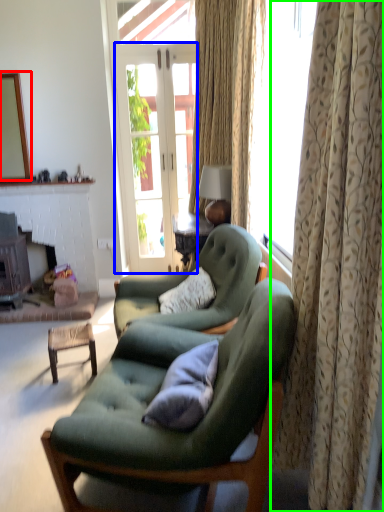
Question: Which is farther away from mirror (highlighted by a red box)? screen door (highlighted by a blue box) or curtain (highlighted by a green box)?

Choices:
 (A) screen door
 (B) curtain

Answer: (B)